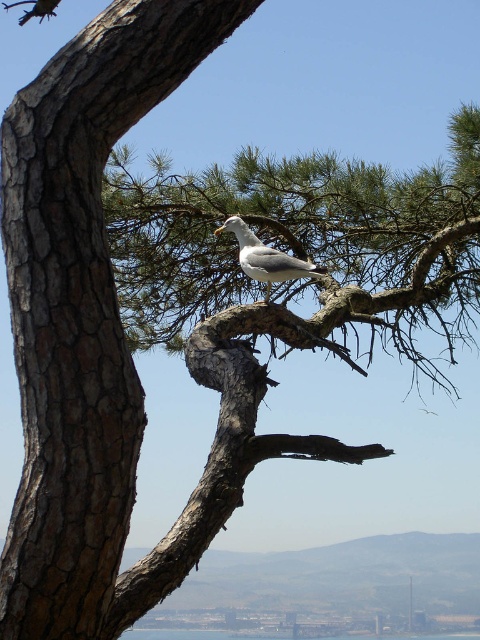
Question: Can you confirm if white matte bird at upper center is bigger than transparent blue water at center?

Choices:
 (A) no
 (B) yes

Answer: (B)

Question: Which point appears farthest from the camera in this image?

Choices:
 (A) (126, 636)
 (B) (240, 241)

Answer: (A)

Question: Which of the following is the closest to the observer?

Choices:
 (A) white matte bird at upper center
 (B) transparent blue water at center

Answer: (A)

Question: Does white matte bird at upper center have a smaller size compared to transparent blue water at center?

Choices:
 (A) no
 (B) yes

Answer: (A)

Question: Does white matte bird at upper center have a larger size compared to transparent blue water at center?

Choices:
 (A) yes
 (B) no

Answer: (A)